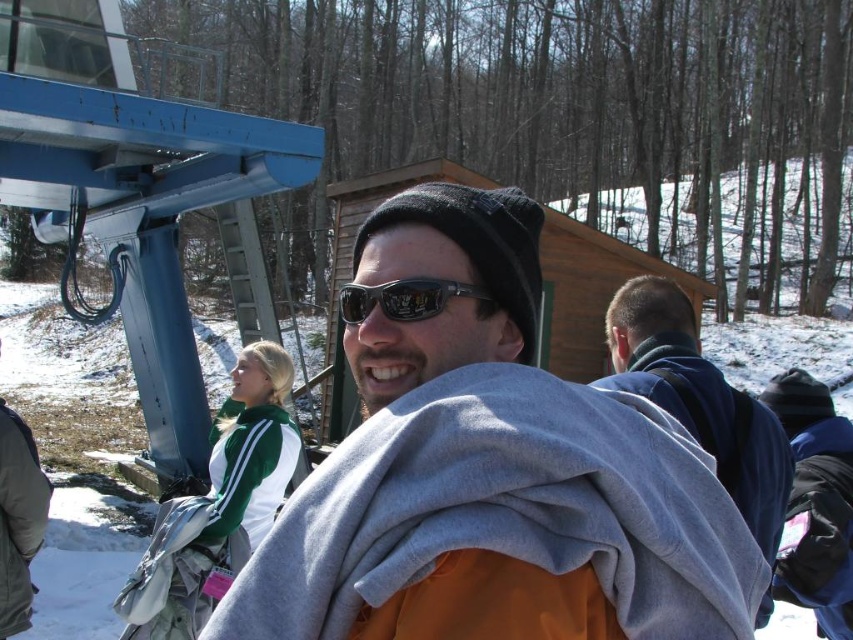
Can you confirm if gray fleece scarf at center is shorter than blue fleece jacket at upper right?

Correct, gray fleece scarf at center is not as tall as blue fleece jacket at upper right.

Does gray fleece scarf at center have a lesser width compared to blue fleece jacket at upper right?

Answer: In fact, gray fleece scarf at center might be wider than blue fleece jacket at upper right.

Which is behind, point (474, 483) or point (674, 378)?

Positioned behind is point (674, 378).

At what (x,y) coordinates should I click in order to perform the action: click on gray fleece scarf at center. Please return your answer as a coordinate pair (x, y). This screenshot has width=853, height=640. Looking at the image, I should click on (491, 474).

Can you confirm if gray fleece scarf at center is smaller than black reflective sunglasses at center?

No, gray fleece scarf at center is not smaller than black reflective sunglasses at center.

Between gray fleece scarf at center and black reflective sunglasses at center, which one has less height?

black reflective sunglasses at center is shorter.

Is point (456, 406) closer to viewer compared to point (457, 289)?

Yes, it is.

This screenshot has height=640, width=853. Identify the location of gray fleece scarf at center. (491, 474).

Does blue fleece jacket at upper right have a greater width compared to black reflective sunglasses at center?

Yes.

Who is positioned more to the right, blue fleece jacket at upper right or black reflective sunglasses at center?

From the viewer's perspective, blue fleece jacket at upper right appears more on the right side.

I want to click on blue fleece jacket at upper right, so click(700, 400).

Image resolution: width=853 pixels, height=640 pixels. I want to click on blue fleece jacket at upper right, so click(x=700, y=400).